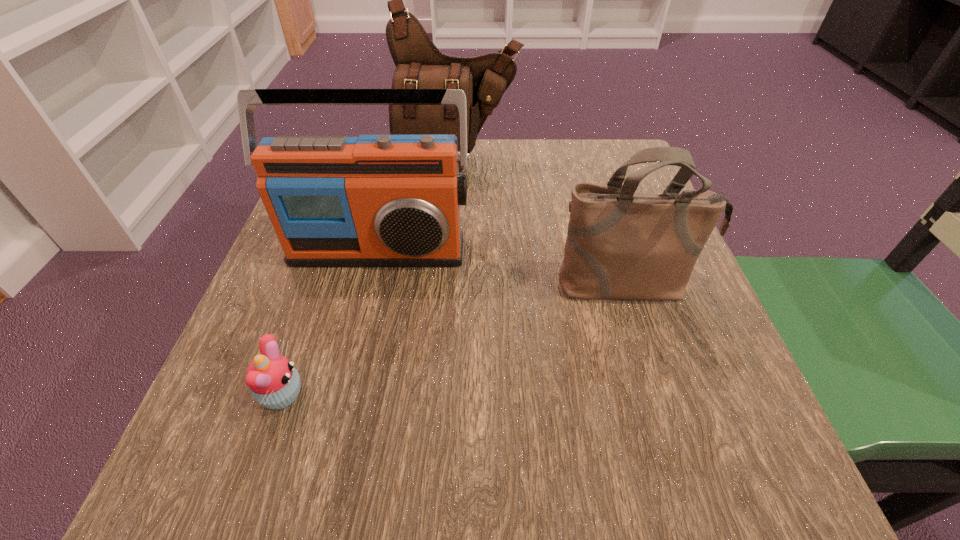
In order to click on the farther shoulder bag in this screenshot , I will do `click(419, 64)`.

Locate an element on the screen. This screenshot has height=540, width=960. the left shoulder bag is located at coordinates coord(419,64).

The image size is (960, 540). Find the location of `radio receiver`. radio receiver is located at coordinates (375, 200).

Locate an element on the screen. This screenshot has height=540, width=960. the right shoulder bag is located at coordinates (620, 244).

Find the location of a particular element. The image size is (960, 540). the nearer shoulder bag is located at coordinates (620, 244).

The image size is (960, 540). Identify the location of cupcake. (274, 382).

The height and width of the screenshot is (540, 960). Find the location of `the nearest object`. the nearest object is located at coordinates (274, 382).

What are the coordinates of `vacant area situated 0.140m on the front-facing side of the farther shoulder bag` in the screenshot? It's located at click(x=453, y=224).

Where is `vacant point located on the front-facing side of the radio receiver`? The height and width of the screenshot is (540, 960). vacant point located on the front-facing side of the radio receiver is located at coordinates (366, 301).

What are the coordinates of `vacant space located 0.140m on the front-facing side of the shorter shoulder bag` in the screenshot? It's located at (658, 382).